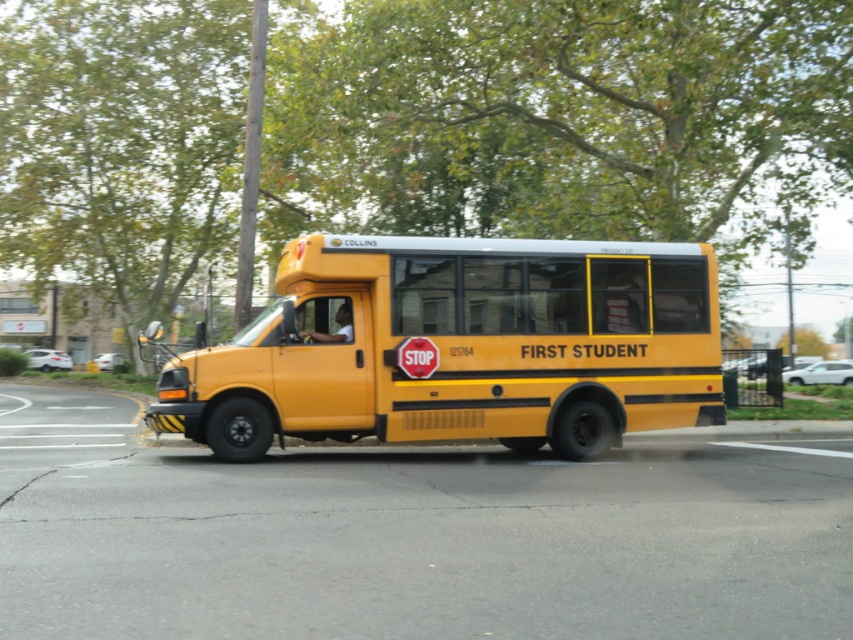
Question: Which point appears closest to the camera in this image?

Choices:
 (A) (415, 369)
 (B) (521, 260)

Answer: (A)

Question: Does yellow matte bus at center lie behind red matte stop sign at center?

Choices:
 (A) no
 (B) yes

Answer: (B)

Question: In this image, where is yellow matte bus at center located relative to red matte stop sign at center?

Choices:
 (A) right
 (B) left

Answer: (A)

Question: Which point appears farthest from the camera in this image?

Choices:
 (A) (340, 349)
 (B) (403, 349)

Answer: (A)

Question: Is yellow matte bus at center to the right of red matte stop sign at center from the viewer's perspective?

Choices:
 (A) no
 (B) yes

Answer: (B)

Question: Which point appears farthest from the camera in this image?

Choices:
 (A) (631, 333)
 (B) (415, 346)

Answer: (A)